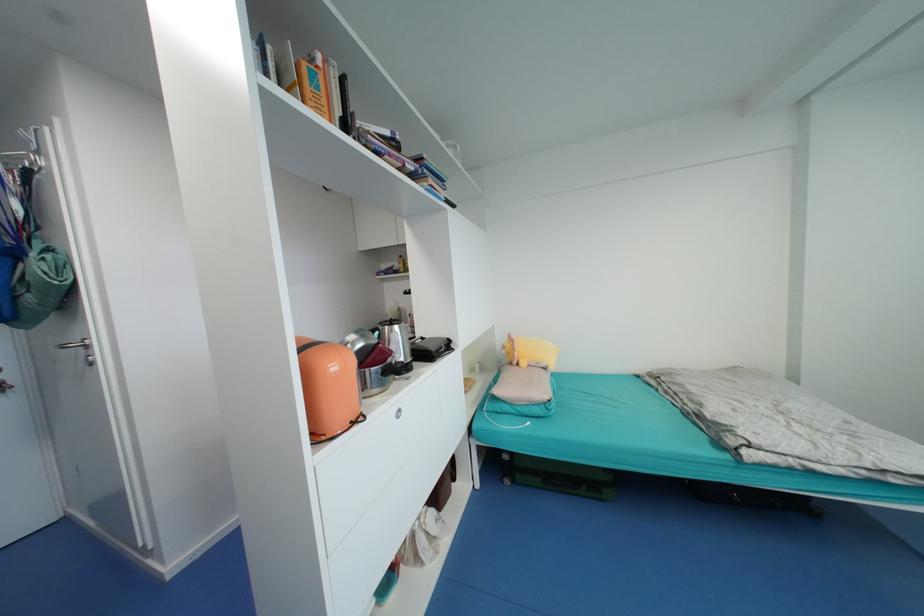
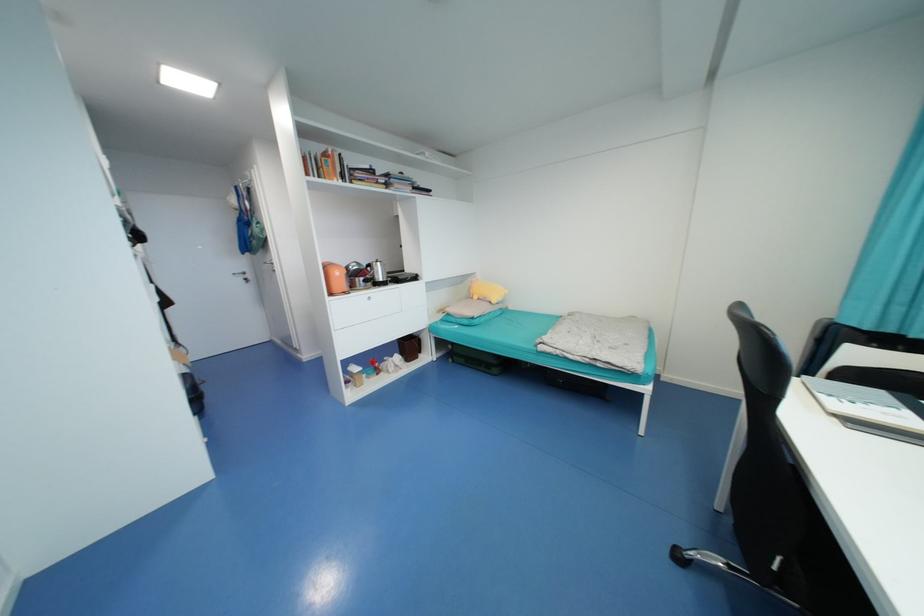
In the second image, find the point that corresponds to [400,328] in the first image.

(383, 264)